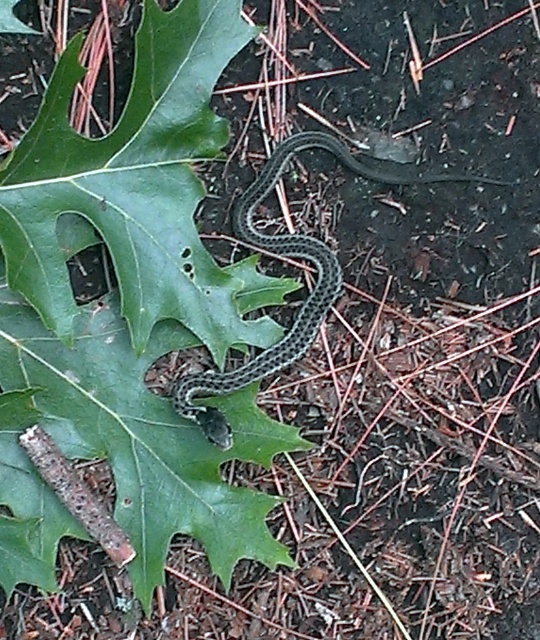
Question: Where is green matte leaf at center located in relation to green textured snake at center in the image?

Choices:
 (A) above
 (B) below

Answer: (B)

Question: Observing the image, what is the correct spatial positioning of green matte leaf at center in reference to green textured snake at center?

Choices:
 (A) right
 (B) left

Answer: (B)

Question: Does green matte leaf at center have a smaller size compared to green textured snake at center?

Choices:
 (A) yes
 (B) no

Answer: (B)